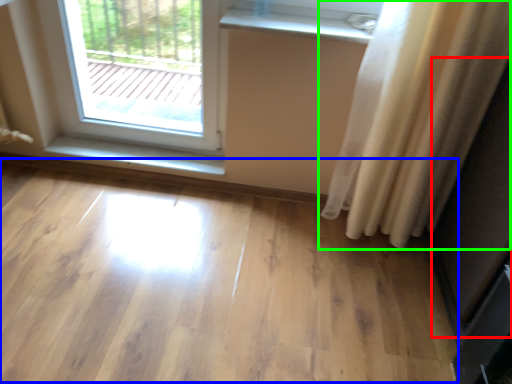
Question: Estimate the real-world distances between objects in this image. Which object is farther from screen door (highlighted by a red box), plain (highlighted by a blue box) or curtain (highlighted by a green box)?

Choices:
 (A) plain
 (B) curtain

Answer: (A)